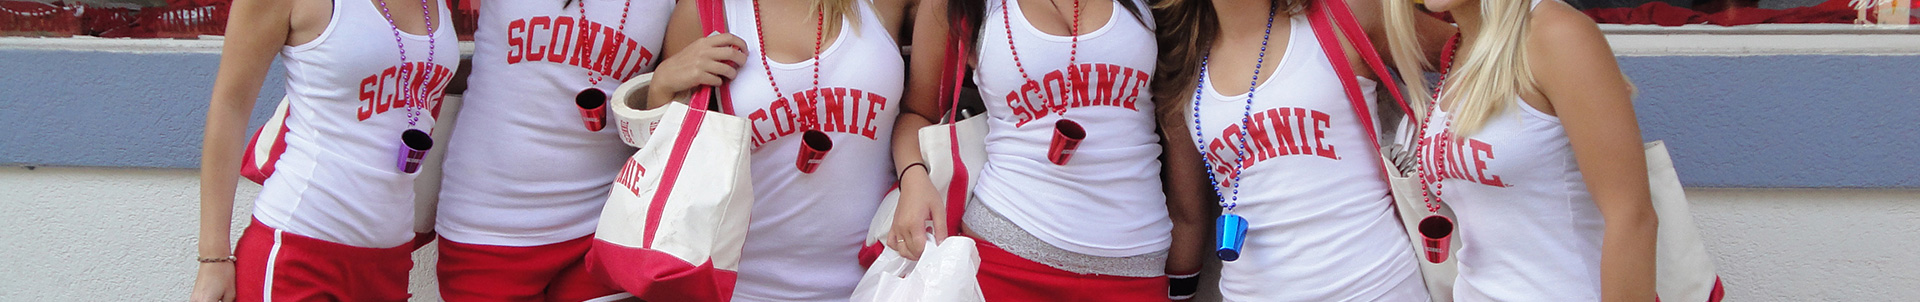
Locate an element on the screen. blue shot glass is located at coordinates (1221, 247).